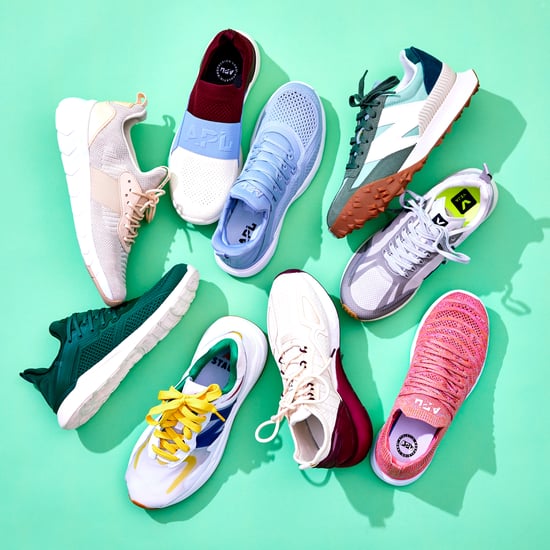
You are a GUI agent. You are given a task and a screenshot of the screen. Output one action in this format:
    pyautogui.click(x=<x>, y=<y>)
    Task: Click on the individual shoes
    The image size is (550, 550).
    Given the screenshot: What is the action you would take?
    pyautogui.click(x=182, y=434), pyautogui.click(x=302, y=348), pyautogui.click(x=440, y=362), pyautogui.click(x=411, y=243), pyautogui.click(x=390, y=134), pyautogui.click(x=295, y=143), pyautogui.click(x=210, y=146), pyautogui.click(x=101, y=192), pyautogui.click(x=95, y=370)